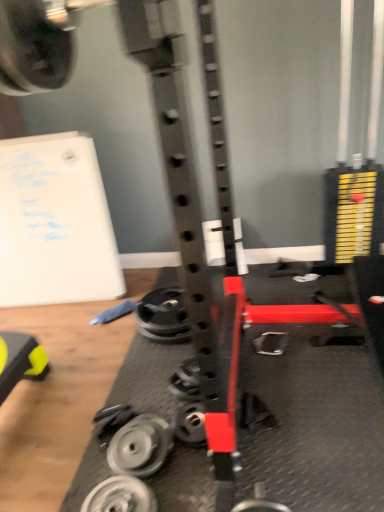
What are the coordinates of `free space above silver metallic weight at lower center, which is counted as the 4th wheel, starting from the back (from a real-world perspective)` in the screenshot? It's located at (115, 495).